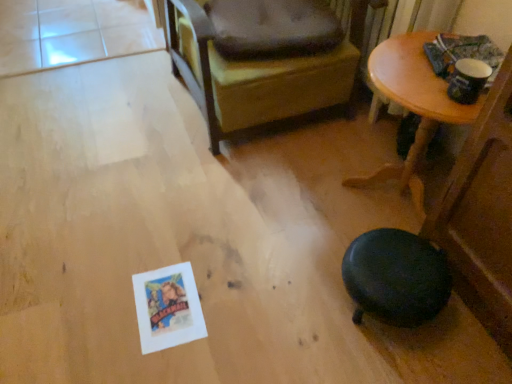
Question: Is dark brown fabric dog bed at upper center taller or shorter than dark brown leather chair at center?

Choices:
 (A) short
 (B) tall

Answer: (A)

Question: Considering the positions of point (245, 39) and point (210, 97), is point (245, 39) closer or farther from the camera than point (210, 97)?

Choices:
 (A) farther
 (B) closer

Answer: (B)

Question: Which object is the closest to the dark brown leather chair at center?

Choices:
 (A) dark brown fabric dog bed at upper center
 (B) wooden table at upper right

Answer: (A)

Question: Estimate the real-world distances between objects in this image. Which object is farther from the dark brown leather chair at center?

Choices:
 (A) dark brown fabric dog bed at upper center
 (B) wooden table at upper right

Answer: (B)